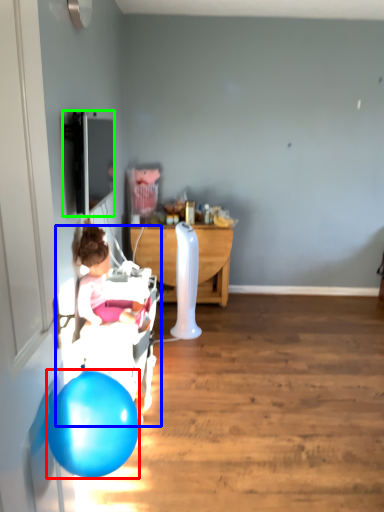
Question: Estimate the real-world distances between objects in this image. Which object is closer to balloon (highlighted by a red box), baby carriage (highlighted by a blue box) or television (highlighted by a green box)?

Choices:
 (A) baby carriage
 (B) television

Answer: (A)